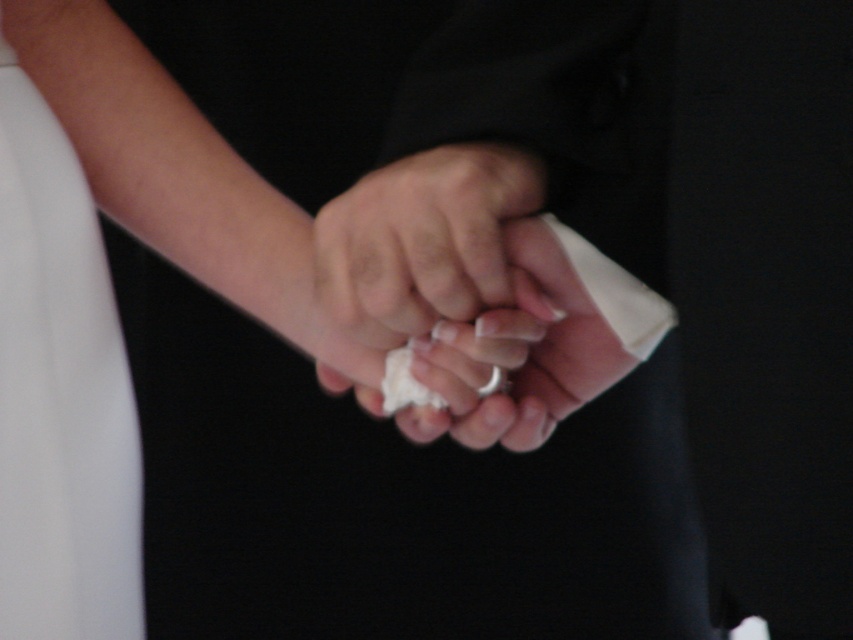
Question: Is white satin dress at left further to camera compared to white matte cloth at center?

Choices:
 (A) no
 (B) yes

Answer: (B)

Question: Among these objects, which one is farthest from the camera?

Choices:
 (A) white satin dress at left
 (B) white matte cloth at center
 (C) white matte tissue at center

Answer: (A)

Question: Estimate the real-world distances between objects in this image. Which object is farther from the white satin dress at left?

Choices:
 (A) silver metallic ring at center
 (B) white matte tissue at center

Answer: (A)

Question: Does white matte cloth at center have a greater width compared to silver metallic ring at center?

Choices:
 (A) yes
 (B) no

Answer: (A)

Question: Which point is farther from the camera taking this photo?

Choices:
 (A) (480, 275)
 (B) (503, 328)
 (C) (497, 378)
 (D) (97, 308)

Answer: (D)

Question: Is white satin dress at left thinner than silver metallic ring at center?

Choices:
 (A) no
 (B) yes

Answer: (A)